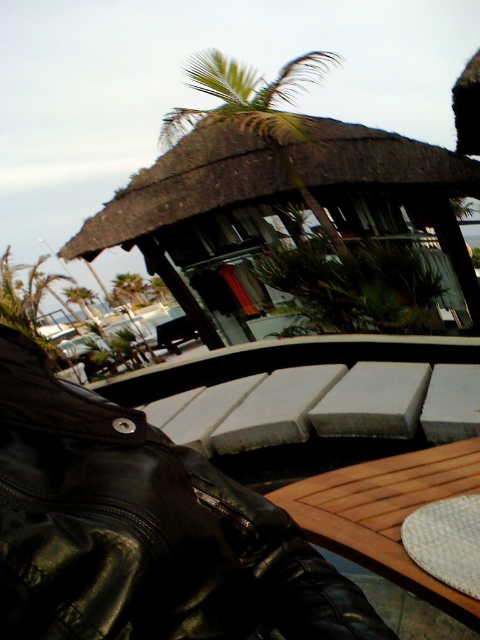
Which is below, wooden table at lower center or green leafy palm tree at upper center?

Positioned lower is wooden table at lower center.

Which is in front, point (327, 538) or point (287, 68)?

Point (327, 538) is in front.

Locate an element on the screen. This screenshot has height=640, width=480. wooden table at lower center is located at coordinates (386, 513).

What are the coordinates of `wooden table at lower center` in the screenshot? It's located at pos(386,513).

Between point (437, 168) and point (360, 525), which one is positioned in front?

Point (360, 525)

Who is higher up, brown thatched hut at upper center or wooden table at lower center?

brown thatched hut at upper center

The height and width of the screenshot is (640, 480). What do you see at coordinates (182, 189) in the screenshot?
I see `brown thatched hut at upper center` at bounding box center [182, 189].

You are a GUI agent. You are given a task and a screenshot of the screen. Output one action in this format:
    pyautogui.click(x=<x>, y=<y>)
    Task: Click on the brown thatched hut at upper center
    
    Given the screenshot: What is the action you would take?
    pyautogui.click(x=182, y=189)

Is point (354, 125) positioned after point (211, 122)?

Yes, point (354, 125) is behind point (211, 122).

Who is more distant from viewer, (151, 173) or (216, 93)?

Positioned behind is point (151, 173).

You are a GUI agent. You are given a task and a screenshot of the screen. Output one action in this format:
    pyautogui.click(x=<x>, y=<y>)
    Task: Click on the brown thatched hut at upper center
    
    Given the screenshot: What is the action you would take?
    pyautogui.click(x=182, y=189)